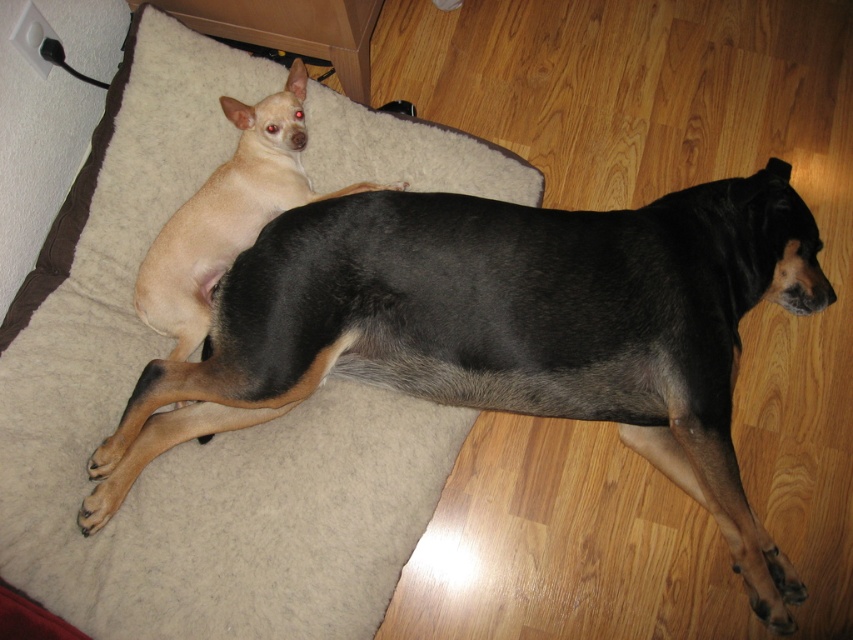
Who is more forward, (589,282) or (151,257)?

Point (589,282) is in front.

What are the coordinates of `black fur dog at upper center` in the screenshot? It's located at (506, 330).

Describe the element at coordinates (506, 330) in the screenshot. The image size is (853, 640). I see `black fur dog at upper center` at that location.

Identify the location of black fur dog at upper center. The width and height of the screenshot is (853, 640). (506, 330).

Between point (80, 392) and point (735, 460), which one is positioned behind?

The point (80, 392) is more distant.

How far apart are beige fleece dog bed at upper left and black fur dog at upper center?

beige fleece dog bed at upper left and black fur dog at upper center are 21.74 centimeters apart from each other.

Who is more distant from viewer, (317, 472) or (541, 220)?

The point (541, 220) is more distant.

Locate an element on the screen. beige fleece dog bed at upper left is located at coordinates (193, 442).

Does point (132, 589) come behind point (198, 316)?

No, (132, 589) is closer to viewer.

Which is in front, point (287, 531) or point (262, 225)?

Point (287, 531) is in front.

This screenshot has width=853, height=640. Identify the location of beige fleece dog bed at upper left. (193, 442).